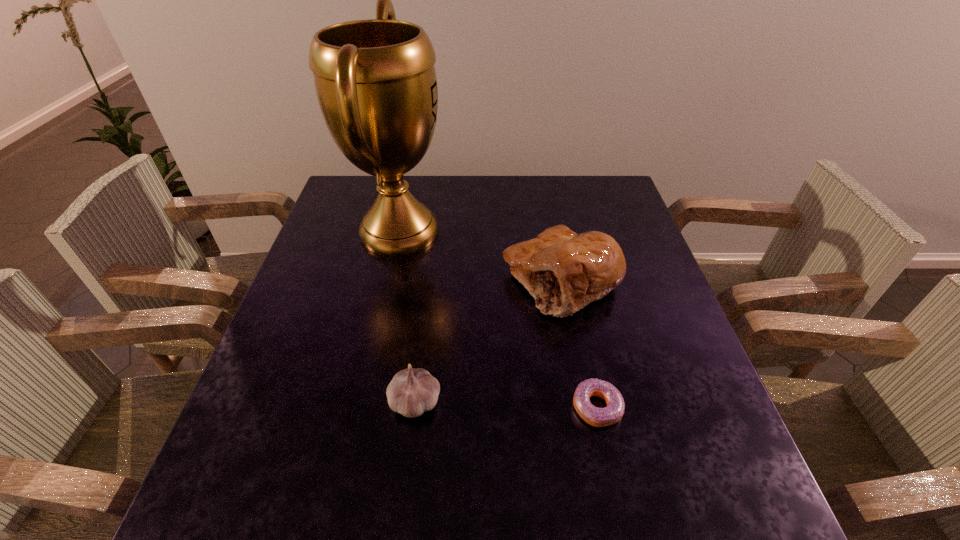
The width and height of the screenshot is (960, 540). In order to click on object that is the second closest to the doughnut in this screenshot , I will do `click(411, 392)`.

This screenshot has height=540, width=960. In order to click on blank area in the image that satisfies the following two spatial constraints: 1. on the surface of the third tallest object with symbols; 2. on the right side of the tallest object in this screenshot , I will do `click(362, 402)`.

The width and height of the screenshot is (960, 540). I want to click on vacant space that satisfies the following two spatial constraints: 1. on the surface of the doughnut with symbols; 2. on the right side of the tallest object, so click(x=361, y=407).

The height and width of the screenshot is (540, 960). Find the location of `free point that satisfies the following two spatial constraints: 1. on the surface of the third tallest object with symbols; 2. on the right side of the tallest object`. free point that satisfies the following two spatial constraints: 1. on the surface of the third tallest object with symbols; 2. on the right side of the tallest object is located at coordinates (362, 402).

Locate an element on the screen. free space that satisfies the following two spatial constraints: 1. on the surface of the shortest object with symbols; 2. on the left side of the trophy cup is located at coordinates (361, 407).

Where is `free spot that satisfies the following two spatial constraints: 1. on the back side of the third tallest object; 2. on the surface of the trophy cup with symbols`? free spot that satisfies the following two spatial constraints: 1. on the back side of the third tallest object; 2. on the surface of the trophy cup with symbols is located at coordinates (435, 231).

Find the location of a particular element. This screenshot has width=960, height=540. vacant region that satisfies the following two spatial constraints: 1. on the back side of the doughnut; 2. on the filling side of the third shortest object is located at coordinates (569, 281).

Where is `vacant point that satisfies the following two spatial constraints: 1. on the filling side of the doughnut; 2. on the right side of the second tallest object`? This screenshot has height=540, width=960. vacant point that satisfies the following two spatial constraints: 1. on the filling side of the doughnut; 2. on the right side of the second tallest object is located at coordinates (586, 407).